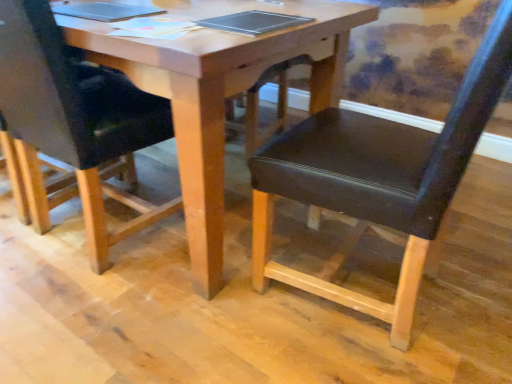
Question: From their relative heights in the image, would you say black leather chair at center, which ranks as the 2th chair in right-to-left order, is taller or shorter than metallic silver notebook at center?

Choices:
 (A) tall
 (B) short

Answer: (A)

Question: Looking at their shapes, would you say black leather chair at center, acting as the 1th chair starting from the left, is wider or thinner than metallic silver notebook at center?

Choices:
 (A) wide
 (B) thin

Answer: (A)

Question: Which object is positioned farthest from the wooden table at center?

Choices:
 (A) metallic silver notebook at center
 (B) black leather chair at center, marked as the second chair in a left-to-right arrangement
 (C) black leather chair at center, which ranks as the 2th chair in right-to-left order

Answer: (C)

Question: Estimate the real-world distances between objects in this image. Which object is farther from the black leather chair at center, which ranks as the 2th chair in right-to-left order?

Choices:
 (A) wooden table at center
 (B) metallic silver notebook at center
 (C) black leather chair at center, marked as the second chair in a left-to-right arrangement

Answer: (C)